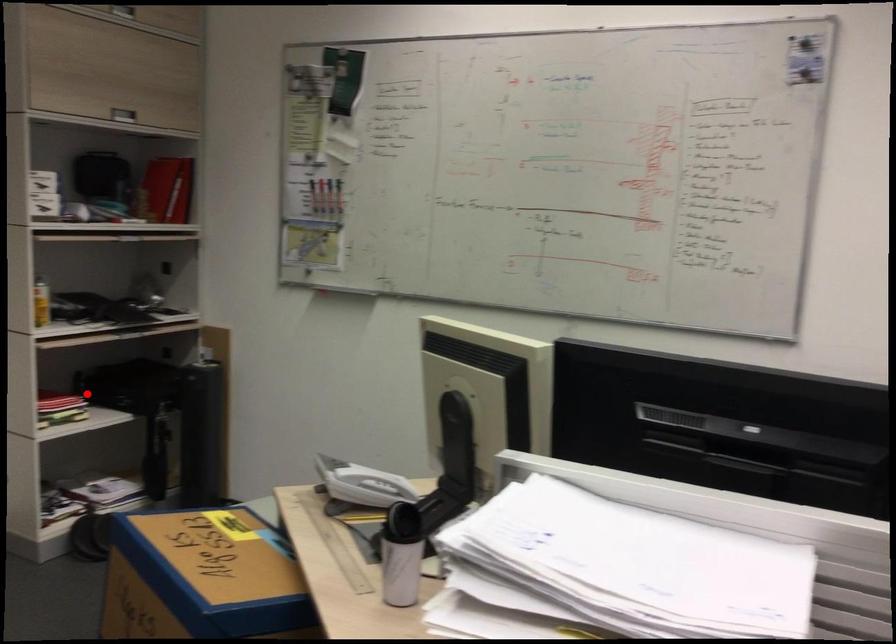
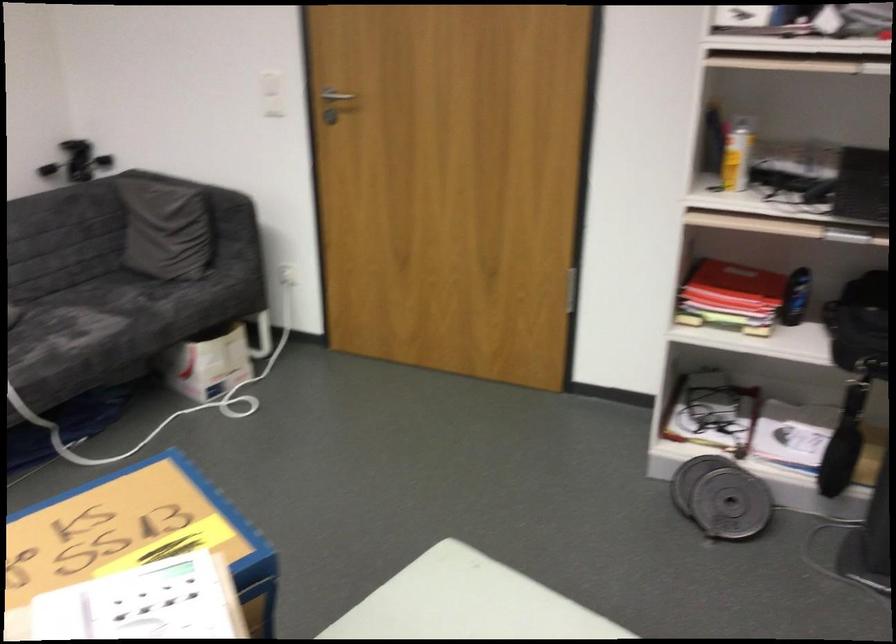
Question: I am providing you with two images of the same scene from different viewpoints. Image1 has a red point marked. In image2, the corresponding 3D location appears at what relative position? Reply with the corresponding letter.

Choices:
 (A) Closer
 (B) Farther

Answer: (A)